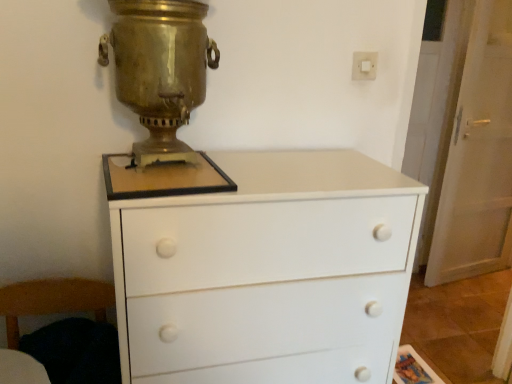
Question: Considering the relative positions of white plastic switch at upper right and gold polished samovar at center in the image provided, is white plastic switch at upper right to the left of gold polished samovar at center from the viewer's perspective?

Choices:
 (A) yes
 (B) no

Answer: (B)

Question: Are white plastic switch at upper right and gold polished samovar at center far apart?

Choices:
 (A) yes
 (B) no

Answer: (B)

Question: Considering the relative sizes of white plastic switch at upper right and gold polished samovar at center in the image provided, is white plastic switch at upper right shorter than gold polished samovar at center?

Choices:
 (A) no
 (B) yes

Answer: (B)

Question: Is white plastic switch at upper right behind gold polished samovar at center?

Choices:
 (A) yes
 (B) no

Answer: (A)

Question: Would you say white plastic switch at upper right contains gold polished samovar at center?

Choices:
 (A) yes
 (B) no

Answer: (B)

Question: Considering their positions, is white plastic switch at upper right located in front of or behind gold polished samovar at center?

Choices:
 (A) behind
 (B) front

Answer: (A)

Question: Looking at their shapes, would you say white plastic switch at upper right is wider or thinner than gold polished samovar at center?

Choices:
 (A) thin
 (B) wide

Answer: (A)

Question: Visually, is white plastic switch at upper right positioned to the left or to the right of gold polished samovar at center?

Choices:
 (A) right
 (B) left

Answer: (A)

Question: Is white plastic switch at upper right bigger or smaller than gold polished samovar at center?

Choices:
 (A) big
 (B) small

Answer: (B)

Question: From the image's perspective, is gold polished samovar at center located above or below wooden armchair at lower left?

Choices:
 (A) above
 (B) below

Answer: (A)

Question: Is gold polished samovar at center taller or shorter than wooden armchair at lower left?

Choices:
 (A) tall
 (B) short

Answer: (A)

Question: Is gold polished samovar at center situated inside wooden armchair at lower left or outside?

Choices:
 (A) outside
 (B) inside

Answer: (A)

Question: Based on their sizes in the image, would you say gold polished samovar at center is bigger or smaller than wooden armchair at lower left?

Choices:
 (A) small
 (B) big

Answer: (A)

Question: Is white plastic switch at upper right to the left or to the right of wooden armchair at lower left in the image?

Choices:
 (A) left
 (B) right

Answer: (B)

Question: Is point (364, 54) closer or farther from the camera than point (83, 360)?

Choices:
 (A) closer
 (B) farther

Answer: (B)